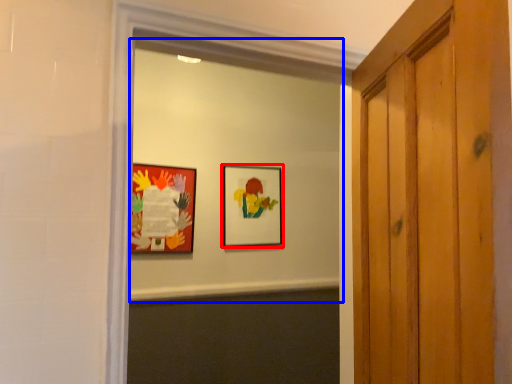
Question: Which object is further to the camera taking this photo, picture frame (highlighted by a red box) or mirror (highlighted by a blue box)?

Choices:
 (A) picture frame
 (B) mirror

Answer: (A)